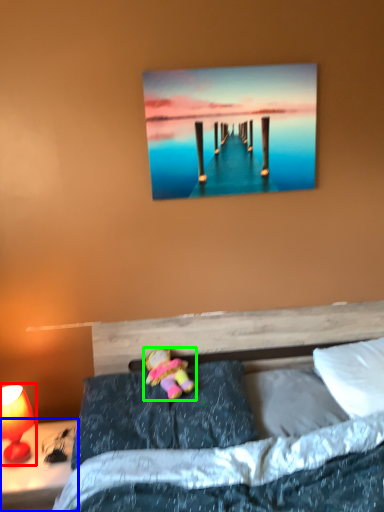
Question: Which object is the farthest from table lamp (highlighted by a red box)? Choose among these: nightstand (highlighted by a blue box) or doll (highlighted by a green box).

Choices:
 (A) nightstand
 (B) doll

Answer: (B)